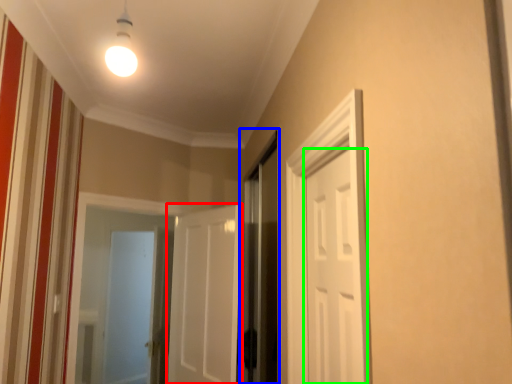
Question: Which object is the farthest from door (highlighted by a red box)? Choose among these: screen door (highlighted by a blue box) or door (highlighted by a green box).

Choices:
 (A) screen door
 (B) door

Answer: (B)